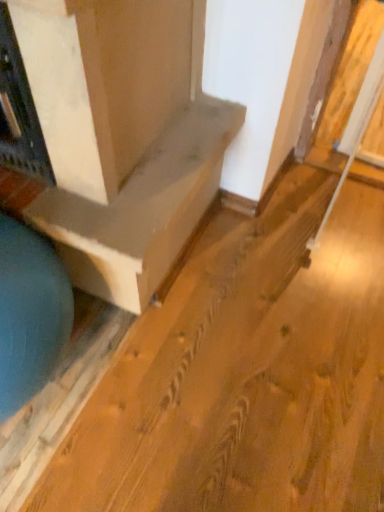
The image size is (384, 512). In order to click on vacant space situated above smooth concrete bench at center (from a real-world perspective) in this screenshot , I will do `click(122, 169)`.